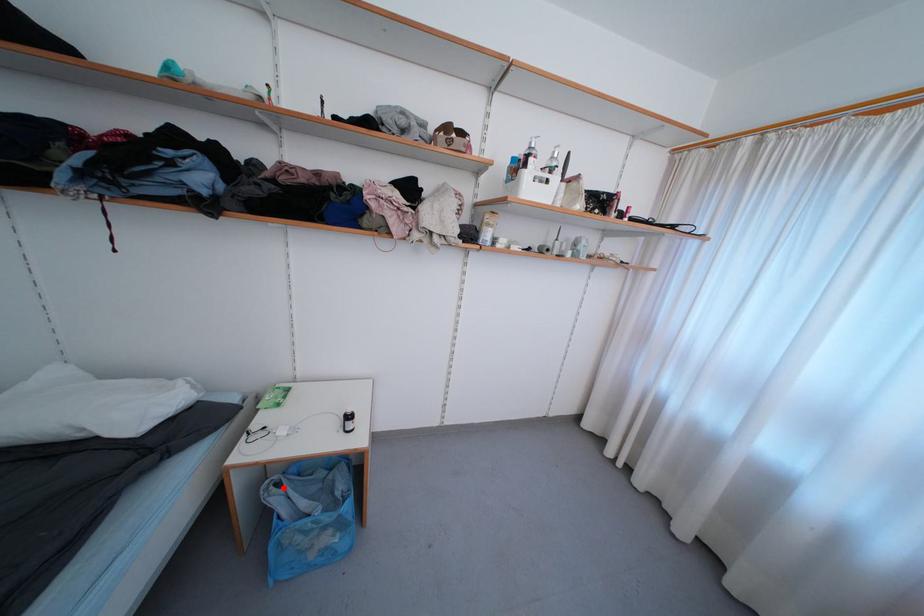
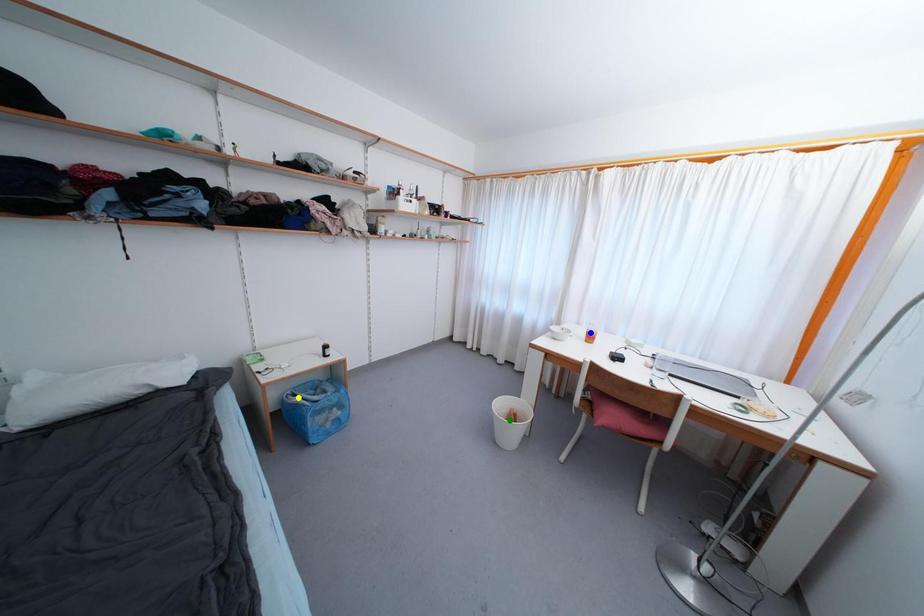
Question: I am providing you with two images of the same scene from different viewpoints. A red point is marked on the first image. You are given multiple points on the second image. In image 2, which mark is for the same physical point as the one in image 1?

Choices:
 (A) yellow point
 (B) green point
 (C) blue point

Answer: (A)